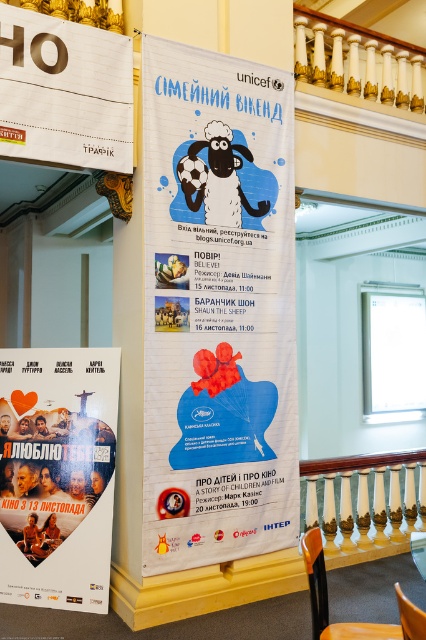
Question: Which of the following is the farthest from the observer?

Choices:
 (A) matte paper poster at lower left
 (B) brown wooden chair at lower right
 (C) orange plastic chair at lower right

Answer: (A)

Question: Which object appears closest to the camera in this image?

Choices:
 (A) wooden sign at upper left
 (B) brown wooden chair at lower right

Answer: (B)

Question: Does blue paper poster at center appear over matte paper poster at lower left?

Choices:
 (A) no
 (B) yes

Answer: (B)

Question: Is wooden sign at upper left smaller than orange plastic chair at lower right?

Choices:
 (A) yes
 (B) no

Answer: (B)

Question: Is wooden sign at upper left positioned before brown wooden chair at lower right?

Choices:
 (A) no
 (B) yes

Answer: (A)

Question: Which of these objects is positioned farthest from the brown wooden chair at lower right?

Choices:
 (A) wooden sign at upper left
 (B) matte paper poster at lower left
 (C) orange plastic chair at lower right
 (D) blue paper poster at center

Answer: (A)